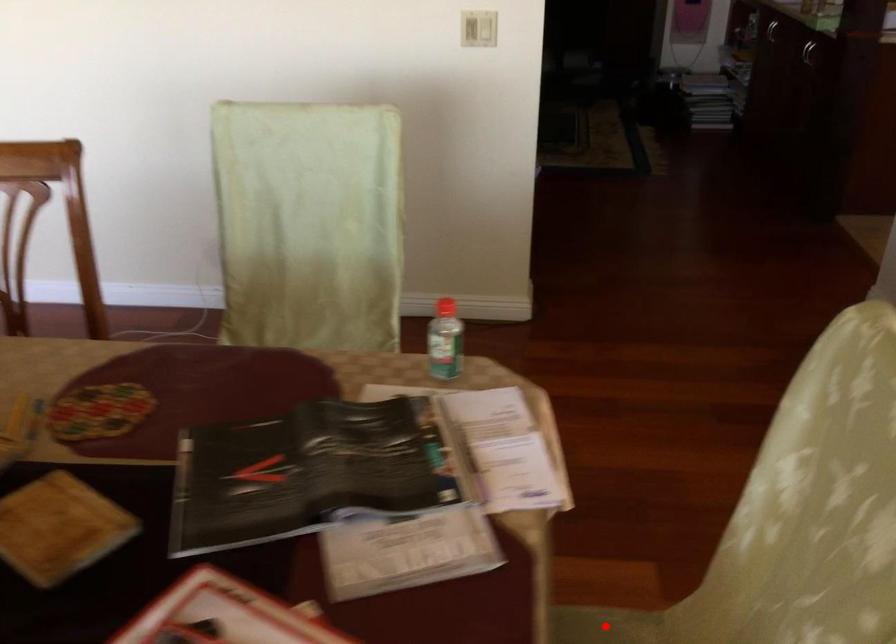
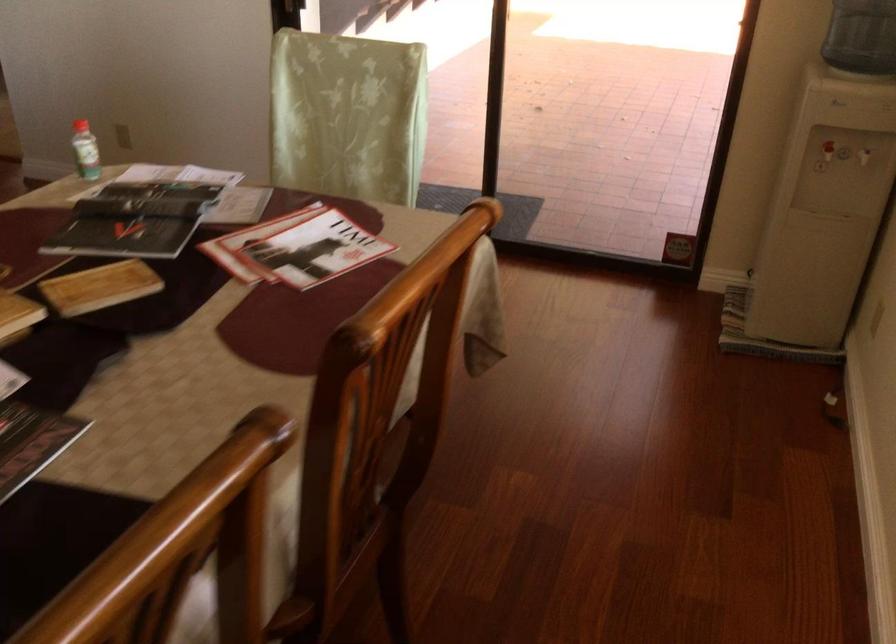
Question: I am providing you with two images of the same scene from different viewpoints. A red point is marked on the first image. At the location where the point appears in image 1, is it still visible in image 2?

Choices:
 (A) Yes
 (B) No

Answer: (B)